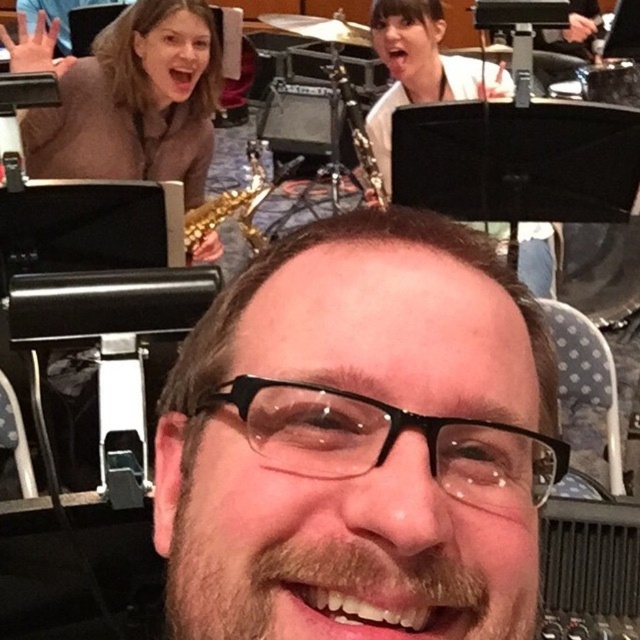
You are a photographer adjusting your camera settings to capture a close shot of the brown matte glasses at center. The camera requires the subject to be at least 14 inches away to focus properly. Based on the scene, will the glasses be in focus?

The brown matte glasses at center is only 12.96 inches away from the camera, which is closer than the required 14 inches. Therefore, the glasses will not be in focus.

You are a photographer adjusting your camera settings to capture a detailed shot of both the brown matte glasses at center and the gold metallic saxophone at upper center. Given that your camera has a fixed focal length, which object should you focus on to ensure it fills more of the frame?

The brown matte glasses at center should be focused on because its width is larger than the gold metallic saxophone at upper center, so it will occupy more space in the frame.

You are standing in the music hall and want to move from point A to point B. Point A is at coordinate point (195,340) and point B is at coordinate point (381,186). Which point is closer to you?

Point A at coordinate point (195,340) is closer to you than point B at coordinate point (381,186).